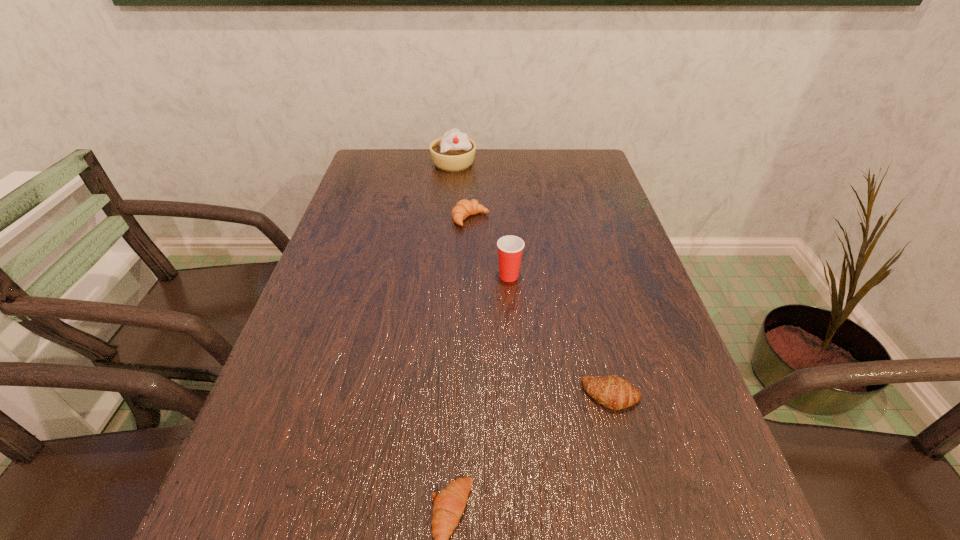
I want to click on whipped cream, so click(453, 152).

This screenshot has width=960, height=540. What are the coordinates of `the third nearest object` in the screenshot? It's located at [510, 248].

Find the location of a particular element. The width and height of the screenshot is (960, 540). the fourth object from left to right is located at coordinates (510, 248).

You are a GUI agent. You are given a task and a screenshot of the screen. Output one action in this format:
    pyautogui.click(x=<x>, y=<y>)
    Task: Click on the fourth nearest object
    
    Given the screenshot: What is the action you would take?
    pyautogui.click(x=464, y=208)

Locate an element on the screen. The image size is (960, 540). the rightmost crescent roll is located at coordinates (616, 393).

This screenshot has width=960, height=540. In order to click on the rightmost object in this screenshot , I will do `click(616, 393)`.

The height and width of the screenshot is (540, 960). What are the coordinates of `free space located 0.180m on the right of the farthest object` in the screenshot? It's located at (532, 163).

Identify the location of free region located 0.140m on the back of the Dixie cup. The image size is (960, 540). (506, 232).

Locate an element on the screen. The width and height of the screenshot is (960, 540). vacant space situated 0.140m on the front of the second farthest object is located at coordinates point(469,265).

This screenshot has width=960, height=540. Identify the location of vacant space located 0.120m on the back of the rightmost crescent roll. (595, 329).